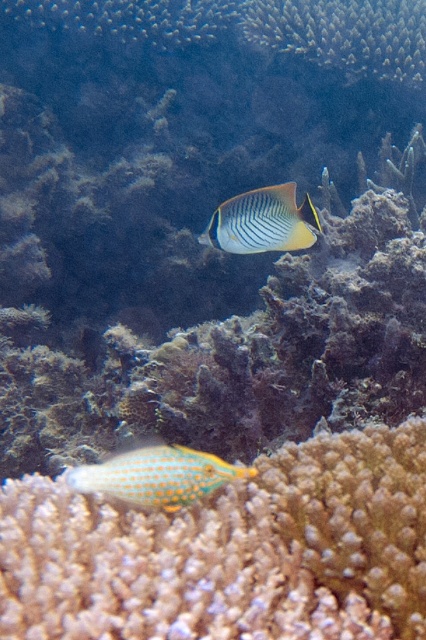
Question: Which object is closer to the camera taking this photo?

Choices:
 (A) orange speckled fish at lower left
 (B) orange spotted coral at lower center
 (C) striped yellow fish at center

Answer: (B)

Question: Can you confirm if orange spotted coral at lower center is positioned above orange speckled fish at lower left?

Choices:
 (A) no
 (B) yes

Answer: (A)

Question: Among these objects, which one is farthest from the camera?

Choices:
 (A) striped yellow fish at center
 (B) orange spotted coral at lower center
 (C) orange speckled fish at lower left

Answer: (A)

Question: Is orange speckled fish at lower left above striped yellow fish at center?

Choices:
 (A) yes
 (B) no

Answer: (B)

Question: Among these points, which one is farthest from the camera?

Choices:
 (A) (319, 444)
 (B) (158, 477)
 (C) (236, 211)

Answer: (C)

Question: Considering the relative positions of orange spotted coral at lower center and striped yellow fish at center in the image provided, where is orange spotted coral at lower center located with respect to striped yellow fish at center?

Choices:
 (A) below
 (B) above

Answer: (A)